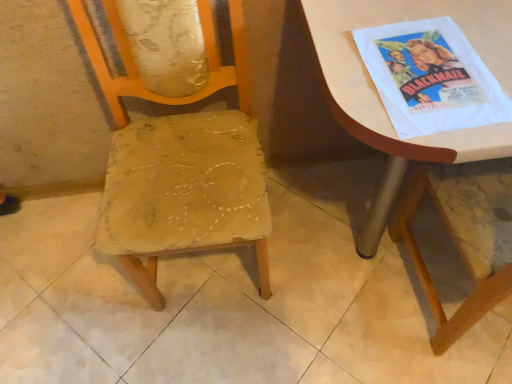
In order to click on vacant area situated below white paper poster at upper right (from a real-world perspective) in this screenshot , I will do `click(425, 74)`.